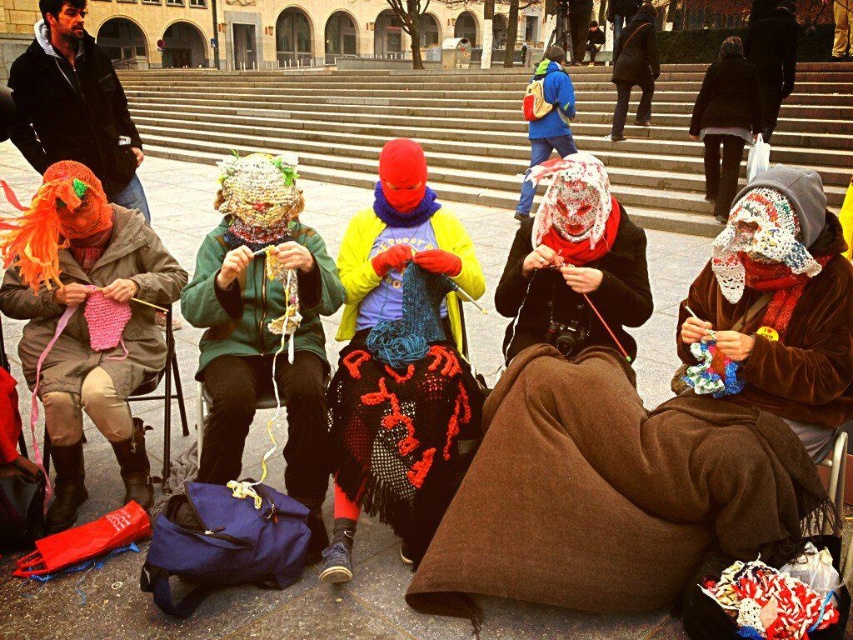
Who is taller, yellow fleece jacket at center or matte pink yarn at left?

matte pink yarn at left

Who is more forward, (x=366, y=451) or (x=106, y=419)?

Point (x=366, y=451) is in front.

Where is `yellow fleece jacket at center`? Image resolution: width=853 pixels, height=640 pixels. yellow fleece jacket at center is located at coordinates (398, 364).

Does yellow fleece jacket at center have a larger size compared to blue fleece jacket at upper center?

No, yellow fleece jacket at center is not bigger than blue fleece jacket at upper center.

Can you confirm if yellow fleece jacket at center is thinner than blue fleece jacket at upper center?

Yes, yellow fleece jacket at center is thinner than blue fleece jacket at upper center.

What are the coordinates of `yellow fleece jacket at center` in the screenshot? It's located at (398, 364).

Does point (270, 189) come behind point (817, 218)?

Yes, point (270, 189) is behind point (817, 218).

Can you confirm if green knitted hat at center is wider than velvet brown coat at lower right?

In fact, green knitted hat at center might be narrower than velvet brown coat at lower right.

Between point (323, 531) and point (747, 208), which one is positioned behind?

The point (323, 531) is more distant.

You are a GUI agent. You are given a task and a screenshot of the screen. Output one action in this format:
    pyautogui.click(x=<x>, y=<y>)
    Task: Click on the green knitted hat at center
    
    Given the screenshot: What is the action you would take?
    pyautogui.click(x=263, y=326)